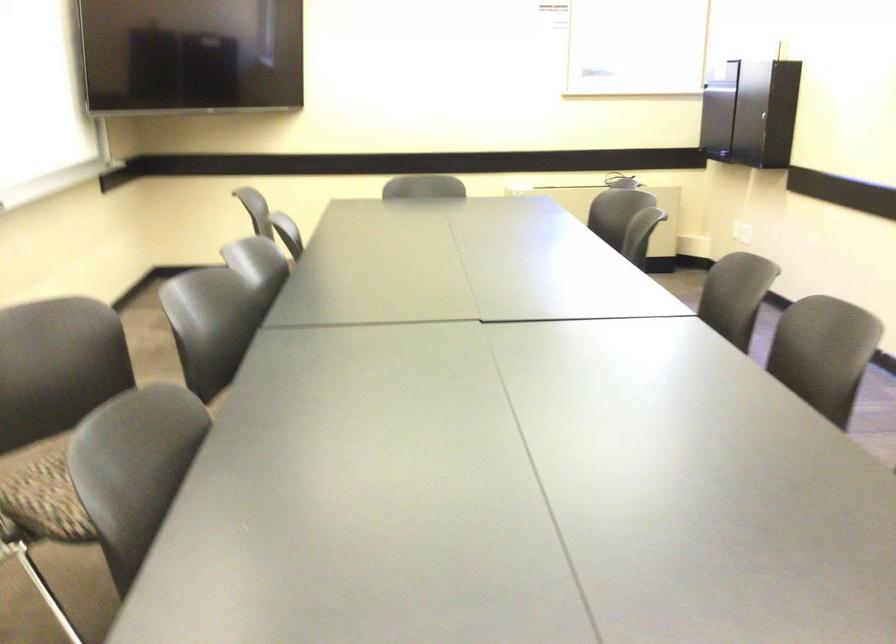
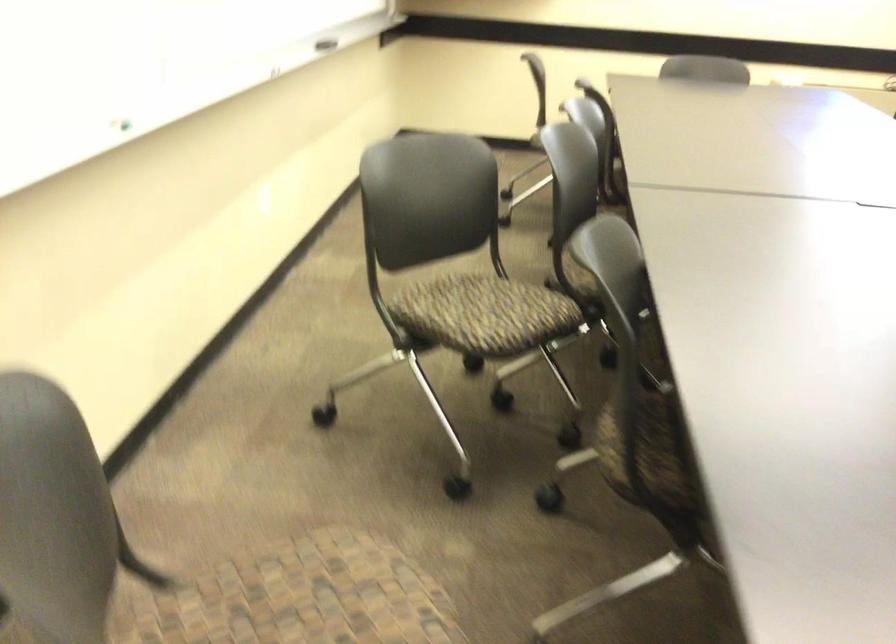
Question: What movement of the cameraman would produce the second image?

Choices:
 (A) Left
 (B) Right
 (C) Forward
 (D) Backward

Answer: (A)